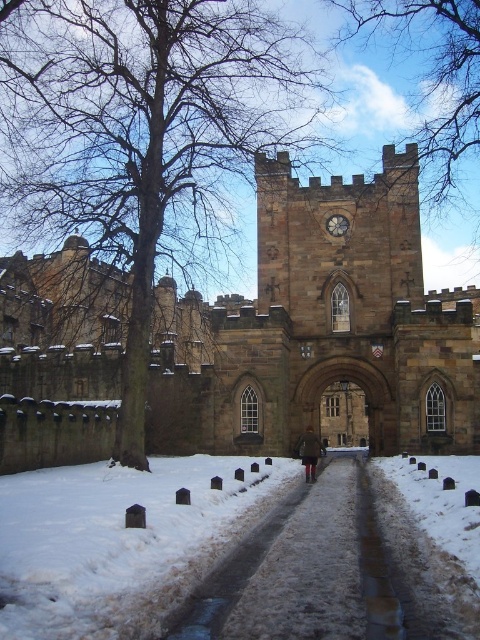
From the picture: You are standing in front of the historic stone castle and want to take a photo of the brown leafless tree at center and the bare branches at upper center. Which object will appear closer to the camera in the photo?

The brown leafless tree at center will appear closer to the camera in the photo because it is in front of the bare branches at upper center.

You are standing at the base of the brown leafless tree at center. Looking towards the castle, where would you see the clock tower located?

The clock tower is located to the right side of the brown leafless tree at center, as the tree is positioned at coordinates 0.203 on the x and 0.292 on the y axis.